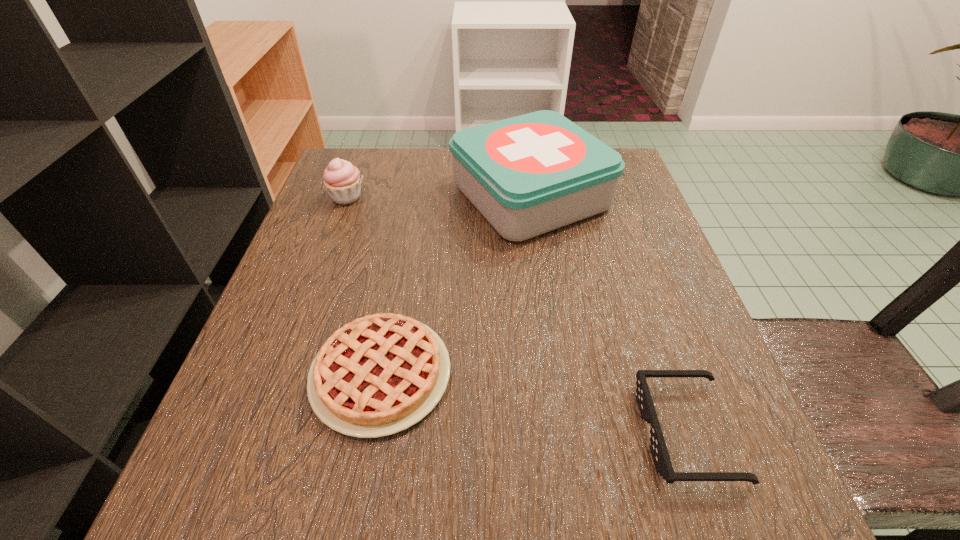
Find the location of a particular element. the first-aid kit is located at coordinates (527, 175).

Where is `the third shortest object`? The width and height of the screenshot is (960, 540). the third shortest object is located at coordinates (342, 180).

Image resolution: width=960 pixels, height=540 pixels. I want to click on cupcake, so click(342, 180).

The width and height of the screenshot is (960, 540). I want to click on pie, so click(x=378, y=375).

Identify the location of sunglasses. This screenshot has height=540, width=960. (659, 451).

Image resolution: width=960 pixels, height=540 pixels. I want to click on free spot located on the left of the tallest object, so click(x=420, y=196).

Identify the location of vacant region located 0.130m on the front of the leftmost object. (327, 249).

Where is `blank area located on the back of the pie`? blank area located on the back of the pie is located at coordinates (401, 264).

This screenshot has height=540, width=960. Identify the location of vacant point located on the front-facing side of the sunglasses. (455, 433).

Image resolution: width=960 pixels, height=540 pixels. In order to click on free space located on the front-facing side of the sunglasses in this screenshot , I will do `click(587, 433)`.